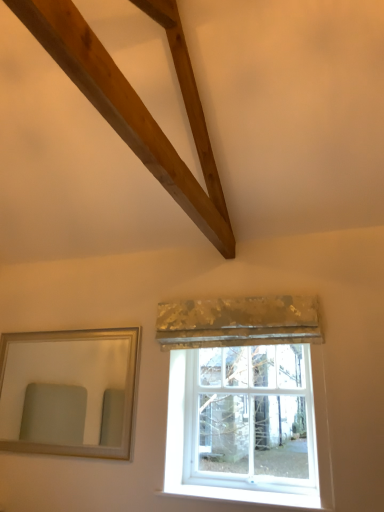
Question: From the image's perspective, does gold sequined curtain at center appear lower than silver/golden-framed mirror at left?

Choices:
 (A) no
 (B) yes

Answer: (A)

Question: Considering the relative sizes of gold sequined curtain at center and silver/golden-framed mirror at left in the image provided, is gold sequined curtain at center thinner than silver/golden-framed mirror at left?

Choices:
 (A) no
 (B) yes

Answer: (A)

Question: Is gold sequined curtain at center next to silver/golden-framed mirror at left?

Choices:
 (A) yes
 (B) no

Answer: (B)

Question: Is gold sequined curtain at center to the left of silver/golden-framed mirror at left from the viewer's perspective?

Choices:
 (A) no
 (B) yes

Answer: (A)

Question: Is gold sequined curtain at center not within silver/golden-framed mirror at left?

Choices:
 (A) no
 (B) yes

Answer: (B)

Question: Is white glass window at center in front of or behind silver/golden-framed mirror at left in the image?

Choices:
 (A) front
 (B) behind

Answer: (A)

Question: Based on their sizes in the image, would you say white glass window at center is bigger or smaller than silver/golden-framed mirror at left?

Choices:
 (A) small
 (B) big

Answer: (A)

Question: Does point (201, 432) appear closer or farther from the camera than point (11, 400)?

Choices:
 (A) farther
 (B) closer

Answer: (B)

Question: From the image's perspective, is white glass window at center positioned above or below silver/golden-framed mirror at left?

Choices:
 (A) above
 (B) below

Answer: (B)

Question: In the image, is gold sequined curtain at center on the left side or the right side of white glass window at center?

Choices:
 (A) right
 (B) left

Answer: (B)

Question: In the image, is gold sequined curtain at center positioned in front of or behind white glass window at center?

Choices:
 (A) front
 (B) behind

Answer: (A)

Question: Which is correct: gold sequined curtain at center is inside white glass window at center, or outside of it?

Choices:
 (A) outside
 (B) inside

Answer: (A)

Question: Is gold sequined curtain at center wider or thinner than white glass window at center?

Choices:
 (A) thin
 (B) wide

Answer: (B)

Question: From a real-world perspective, is silver/golden-framed mirror at left physically located above or below white glass window at center?

Choices:
 (A) below
 (B) above

Answer: (B)

Question: Is silver/golden-framed mirror at left bigger or smaller than white glass window at center?

Choices:
 (A) small
 (B) big

Answer: (B)